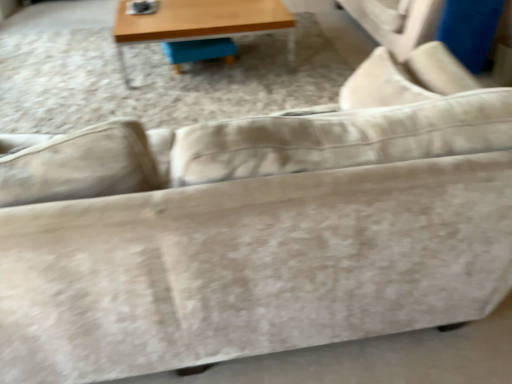
Question: From the image's perspective, is blue fabric swivel chair at center located above or below wooden table at upper center?

Choices:
 (A) below
 (B) above

Answer: (A)

Question: Is blue fabric swivel chair at center spatially inside wooden table at upper center, or outside of it?

Choices:
 (A) inside
 (B) outside

Answer: (A)

Question: Is blue fabric swivel chair at center bigger or smaller than wooden table at upper center?

Choices:
 (A) big
 (B) small

Answer: (B)

Question: Is wooden table at upper center to the left or to the right of blue fabric swivel chair at center in the image?

Choices:
 (A) right
 (B) left

Answer: (A)

Question: In terms of width, does wooden table at upper center look wider or thinner when compared to blue fabric swivel chair at center?

Choices:
 (A) thin
 (B) wide

Answer: (B)

Question: From a real-world perspective, relative to blue fabric swivel chair at center, is wooden table at upper center vertically above or below?

Choices:
 (A) above
 (B) below

Answer: (A)

Question: Is wooden table at upper center taller or shorter than blue fabric swivel chair at center?

Choices:
 (A) short
 (B) tall

Answer: (B)